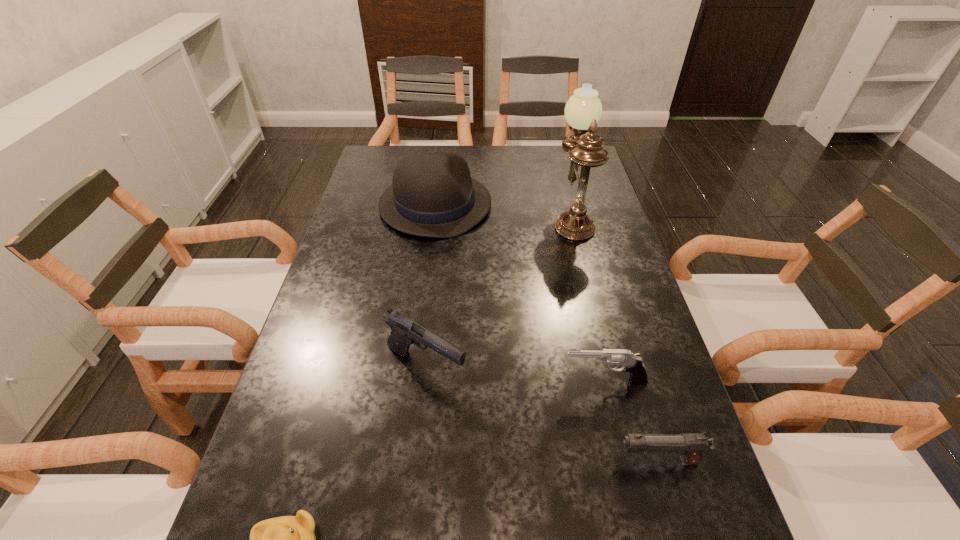
At what (x,y) coordinates should I click in order to perform the action: click on vacant space located 0.250m in the direction the second nearest object is aimed. Please return your answer as a coordinate pair (x, y). Looking at the image, I should click on (480, 461).

I want to click on object located in the far edge section of the desktop, so click(432, 194).

You are a GUI agent. You are given a task and a screenshot of the screen. Output one action in this format:
    pyautogui.click(x=<x>, y=<y>)
    Task: Click on the object present at the left edge
    Image resolution: width=960 pixels, height=540 pixels.
    Given the screenshot: What is the action you would take?
    pyautogui.click(x=432, y=194)

Where is `oil lamp at the right edge`? oil lamp at the right edge is located at coordinates (583, 110).

The width and height of the screenshot is (960, 540). I want to click on object that is at the far left corner, so click(x=432, y=194).

Locate an element on the screen. The width and height of the screenshot is (960, 540). vacant space at the far edge is located at coordinates (523, 175).

You are a GUI agent. You are given a task and a screenshot of the screen. Output one action in this format:
    pyautogui.click(x=<x>, y=<y>)
    Task: Click on the free region at the left edge
    The width and height of the screenshot is (960, 540).
    Given the screenshot: What is the action you would take?
    pyautogui.click(x=327, y=539)

In the image, there is a desktop. At what (x,y) coordinates should I click in order to perform the action: click on blank space at the right edge. Please return your answer as a coordinate pair (x, y). The height and width of the screenshot is (540, 960). Looking at the image, I should click on (630, 302).

The image size is (960, 540). I want to click on free space at the far left corner of the desktop, so click(x=395, y=146).

Where is `free spot between the fifth shortest object and the tallest object`? The width and height of the screenshot is (960, 540). free spot between the fifth shortest object and the tallest object is located at coordinates (504, 210).